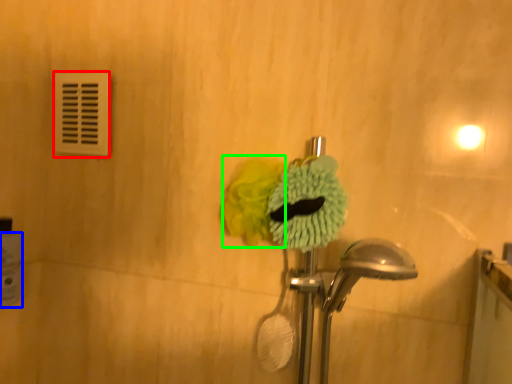
Question: Which object is positioned farthest from light switch (highlighted by a red box)? Select from toilet paper (highlighted by a blue box) and flower (highlighted by a green box).

Choices:
 (A) toilet paper
 (B) flower

Answer: (B)